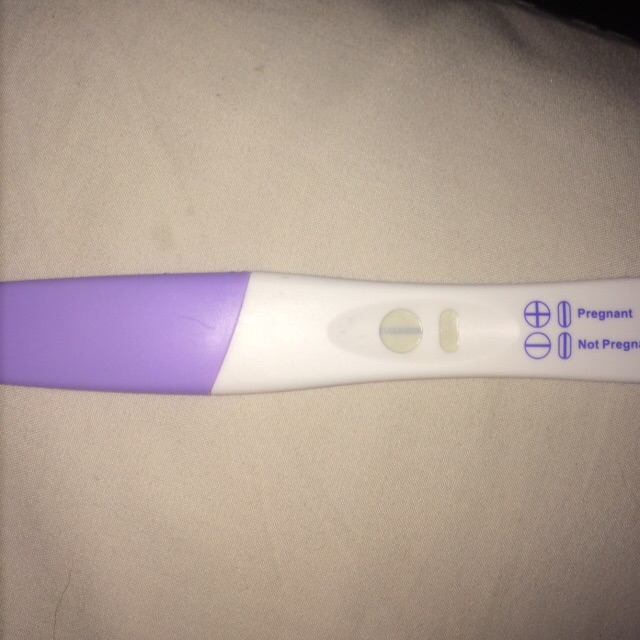
Image resolution: width=640 pixels, height=640 pixels. What are the coordinates of `black area behind counter` in the screenshot? It's located at (625, 15).